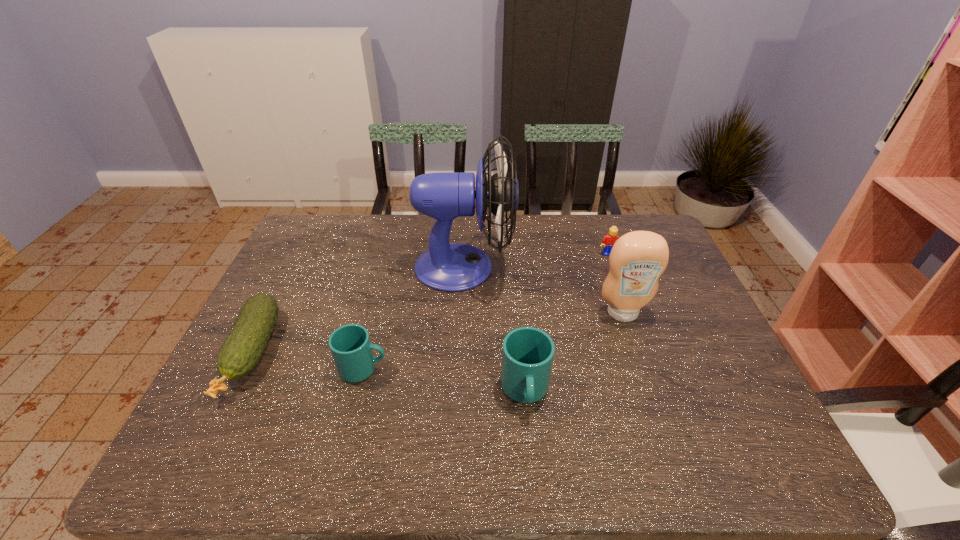
Identify the location of vacant space that satisfies the following two spatial constraints: 1. on the front-facing side of the Lego; 2. in front of the fan where the airflow is directed. (613, 267).

I want to click on vacant space that satisfies the following two spatial constraints: 1. on the front-facing side of the Lego; 2. in front of the tallest object where the airflow is directed, so click(x=613, y=267).

At what (x,y) coordinates should I click in order to perform the action: click on free spot that satisfies the following two spatial constraints: 1. on the front-facing side of the Lego; 2. in front of the tallest object where the airflow is directed. Please return your answer as a coordinate pair (x, y). The width and height of the screenshot is (960, 540). Looking at the image, I should click on (613, 267).